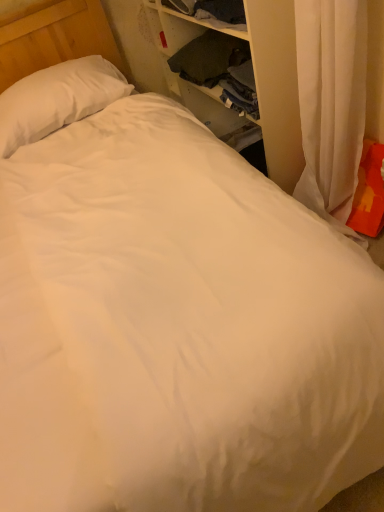
Describe the element at coordinates (57, 99) in the screenshot. Image resolution: width=384 pixels, height=512 pixels. I see `white soft pillow at upper left, which is counted as the 1th pillow, starting from the top` at that location.

Image resolution: width=384 pixels, height=512 pixels. Identify the location of orange fabric pillow at right, which is the second pillow in left-to-right order. (369, 192).

This screenshot has width=384, height=512. In order to click on white soft pillow at upper left, which is the second pillow in right-to-left order in this screenshot , I will do `click(57, 99)`.

Considering the relative positions of white soft pillow at upper left, the 2th pillow positioned from the bottom, and orange fabric pillow at right, which ranks as the first pillow in bottom-to-top order, in the image provided, is white soft pillow at upper left, the 2th pillow positioned from the bottom, behind orange fabric pillow at right, which ranks as the first pillow in bottom-to-top order,?

Yes, it is behind orange fabric pillow at right, which ranks as the first pillow in bottom-to-top order.

Could you tell me if white soft pillow at upper left, acting as the 1th pillow starting from the back, is turned towards orange fabric pillow at right, which is the second pillow in left-to-right order?

No, white soft pillow at upper left, acting as the 1th pillow starting from the back, is not oriented towards orange fabric pillow at right, which is the second pillow in left-to-right order.

Does white soft pillow at upper left, which is counted as the 1th pillow, starting from the top, have a lesser height compared to orange fabric pillow at right, the second pillow when ordered from top to bottom?

Correct, white soft pillow at upper left, which is counted as the 1th pillow, starting from the top, is not as tall as orange fabric pillow at right, the second pillow when ordered from top to bottom.

Does white soft pillow at upper left, the first pillow in the left-to-right sequence, have a lesser width compared to orange fabric pillow at right, marked as the 2th pillow in a back-to-front arrangement?

Incorrect, the width of white soft pillow at upper left, the first pillow in the left-to-right sequence, is not less than that of orange fabric pillow at right, marked as the 2th pillow in a back-to-front arrangement.

From a real-world perspective, is white soft pillow at upper left, the 2th pillow positioned from the bottom, physically located above or below wooden dresser at upper right?

From a real-world perspective, white soft pillow at upper left, the 2th pillow positioned from the bottom, is physically above wooden dresser at upper right.

Is white soft pillow at upper left, which is the second pillow in right-to-left order, looking in the opposite direction of wooden dresser at upper right?

No, wooden dresser at upper right is not at the back of white soft pillow at upper left, which is the second pillow in right-to-left order.

Considering the relative sizes of white soft pillow at upper left, arranged as the 2th pillow when viewed from the front, and wooden dresser at upper right in the image provided, is white soft pillow at upper left, arranged as the 2th pillow when viewed from the front, shorter than wooden dresser at upper right?

Yes, white soft pillow at upper left, arranged as the 2th pillow when viewed from the front, is shorter than wooden dresser at upper right.

Between orange fabric pillow at right, arranged as the first pillow when viewed from the front, and wooden dresser at upper right, which one is positioned behind?

orange fabric pillow at right, arranged as the first pillow when viewed from the front.

From a real-world perspective, between orange fabric pillow at right, marked as the 2th pillow in a back-to-front arrangement, and wooden dresser at upper right, who is vertically lower?

orange fabric pillow at right, marked as the 2th pillow in a back-to-front arrangement, is physically lower.

Which is more to the left, orange fabric pillow at right, the second pillow when ordered from top to bottom, or wooden dresser at upper right?

wooden dresser at upper right.

Where is `pillow that is in front of the white soft pillow at upper left, the 2th pillow positioned from the bottom`? The width and height of the screenshot is (384, 512). pillow that is in front of the white soft pillow at upper left, the 2th pillow positioned from the bottom is located at coordinates [x=369, y=192].

From the image's perspective, is orange fabric pillow at right, the second pillow when ordered from top to bottom, positioned above or below white soft pillow at upper left, acting as the 1th pillow starting from the back?

From the image's perspective, orange fabric pillow at right, the second pillow when ordered from top to bottom, appears below white soft pillow at upper left, acting as the 1th pillow starting from the back.

Considering the points (359, 172) and (59, 90), which point is in front, point (359, 172) or point (59, 90)?

The point (359, 172) is closer to the camera.

Who is smaller, orange fabric pillow at right, marked as the 2th pillow in a back-to-front arrangement, or white soft pillow at upper left, the first pillow in the left-to-right sequence?

Smaller between the two is orange fabric pillow at right, marked as the 2th pillow in a back-to-front arrangement.

Is wooden dresser at upper right positioned far away from white soft pillow at upper left, which is the second pillow in right-to-left order?

Actually, wooden dresser at upper right and white soft pillow at upper left, which is the second pillow in right-to-left order, are a little close together.

Is wooden dresser at upper right facing towards white soft pillow at upper left, acting as the 1th pillow starting from the back?

Yes.

Which is correct: wooden dresser at upper right is inside white soft pillow at upper left, which is the second pillow in right-to-left order, or outside of it?

wooden dresser at upper right is outside white soft pillow at upper left, which is the second pillow in right-to-left order.

Would you say wooden dresser at upper right is a long distance from orange fabric pillow at right, arranged as the first pillow when viewed from the front?

That's not correct — wooden dresser at upper right is a little close to orange fabric pillow at right, arranged as the first pillow when viewed from the front.

Based on the photo, could you tell me if wooden dresser at upper right is facing orange fabric pillow at right, arranged as the first pillow when viewed from the front?

No, wooden dresser at upper right is not turned towards orange fabric pillow at right, arranged as the first pillow when viewed from the front.

Consider the image. Is orange fabric pillow at right, the first pillow viewed from the right, located within wooden dresser at upper right?

Actually, orange fabric pillow at right, the first pillow viewed from the right, is outside wooden dresser at upper right.

How many degrees apart are the facing directions of wooden dresser at upper right and orange fabric pillow at right, marked as the 2th pillow in a back-to-front arrangement?

The facing directions of wooden dresser at upper right and orange fabric pillow at right, marked as the 2th pillow in a back-to-front arrangement, are 17.9 degrees apart.

Locate an element on the screen. pillow on the left of the orange fabric pillow at right, marked as the 2th pillow in a back-to-front arrangement is located at coordinates (57, 99).

Find the location of a particular element. The width and height of the screenshot is (384, 512). dresser above the white soft pillow at upper left, which is counted as the 1th pillow, starting from the top (from the image's perspective) is located at coordinates (276, 86).

Which object lies further to the anchor point orange fabric pillow at right, which ranks as the first pillow in bottom-to-top order, wooden dresser at upper right or white soft pillow at upper left, the first pillow in the left-to-right sequence?

Based on the image, white soft pillow at upper left, the first pillow in the left-to-right sequence, appears to be further to orange fabric pillow at right, which ranks as the first pillow in bottom-to-top order.

Which object lies further to the anchor point wooden dresser at upper right, orange fabric pillow at right, which is the second pillow in left-to-right order, or white soft pillow at upper left, which is counted as the 1th pillow, starting from the top?

Among the two, white soft pillow at upper left, which is counted as the 1th pillow, starting from the top, is located further to wooden dresser at upper right.

Based on the photo, estimate the real-world distances between objects in this image. Which object is closer to white soft pillow at upper left, the first pillow in the left-to-right sequence, wooden dresser at upper right or orange fabric pillow at right, arranged as the first pillow when viewed from the front?

The object closer to white soft pillow at upper left, the first pillow in the left-to-right sequence, is wooden dresser at upper right.

Estimate the real-world distances between objects in this image. Which object is further from wooden dresser at upper right, white soft pillow at upper left, acting as the 1th pillow starting from the back, or orange fabric pillow at right, marked as the 2th pillow in a back-to-front arrangement?

Based on the image, white soft pillow at upper left, acting as the 1th pillow starting from the back, appears to be further to wooden dresser at upper right.

Which object lies further to the anchor point white soft pillow at upper left, the 2th pillow positioned from the bottom, orange fabric pillow at right, the first pillow viewed from the right, or wooden dresser at upper right?

orange fabric pillow at right, the first pillow viewed from the right, is positioned further to the anchor white soft pillow at upper left, the 2th pillow positioned from the bottom.

Looking at the image, which one is located closer to orange fabric pillow at right, which ranks as the first pillow in bottom-to-top order, white soft pillow at upper left, which is counted as the 1th pillow, starting from the top, or wooden dresser at upper right?

wooden dresser at upper right lies closer to orange fabric pillow at right, which ranks as the first pillow in bottom-to-top order, than the other object.

This screenshot has width=384, height=512. Find the location of `dresser situated between white soft pillow at upper left, the first pillow in the left-to-right sequence, and orange fabric pillow at right, arranged as the first pillow when viewed from the front, from left to right`. dresser situated between white soft pillow at upper left, the first pillow in the left-to-right sequence, and orange fabric pillow at right, arranged as the first pillow when viewed from the front, from left to right is located at coordinates (276, 86).